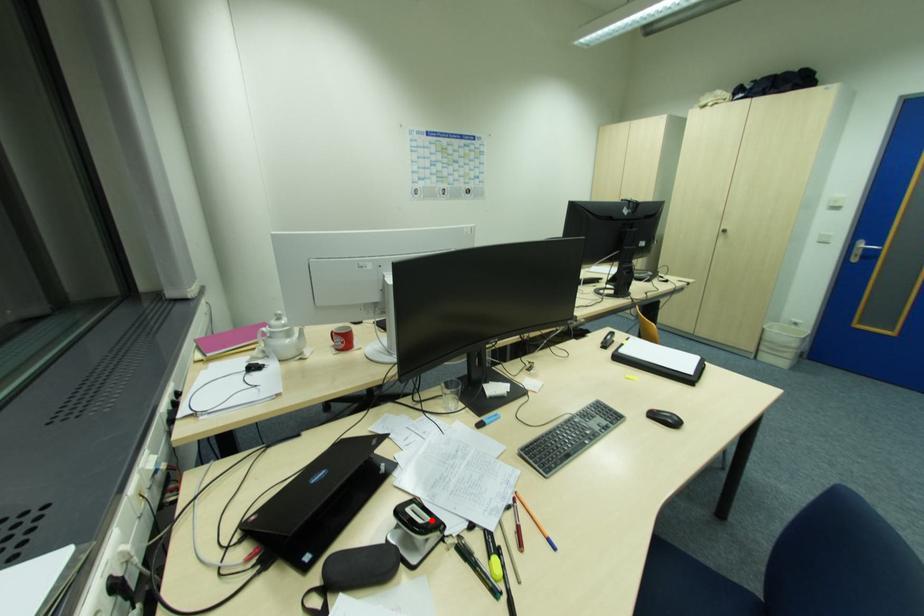
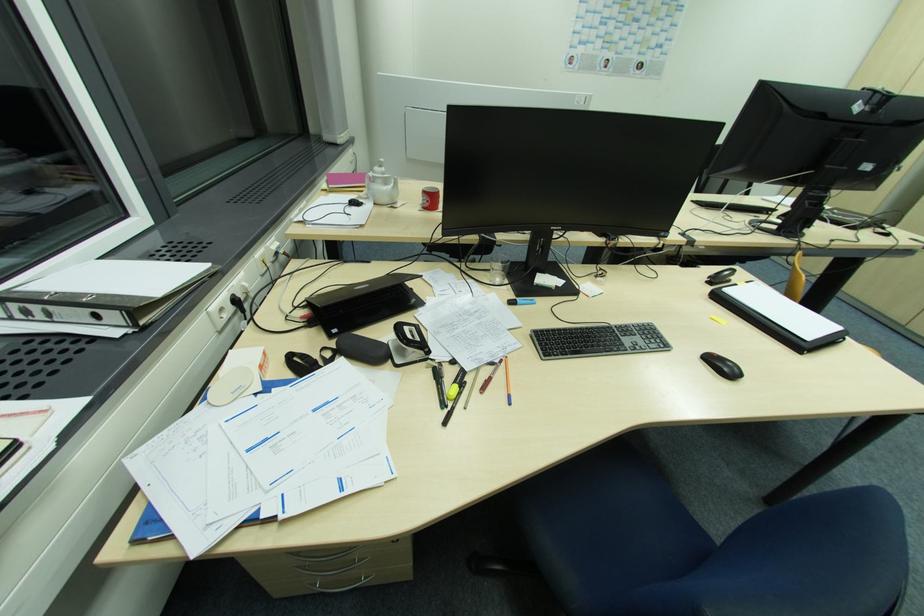
Locate, in the second image, the point that corresponds to the highlighted location in the first image.

(420, 341)